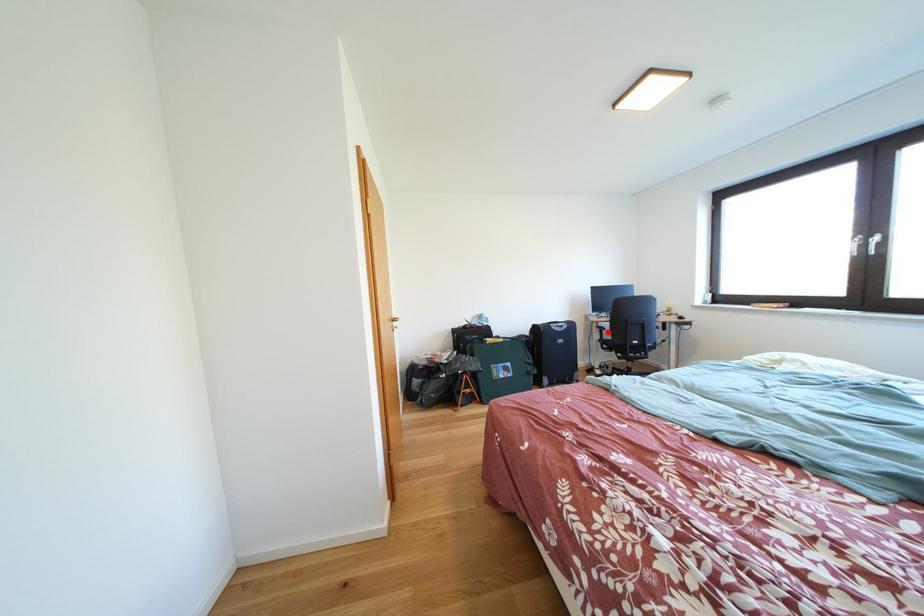
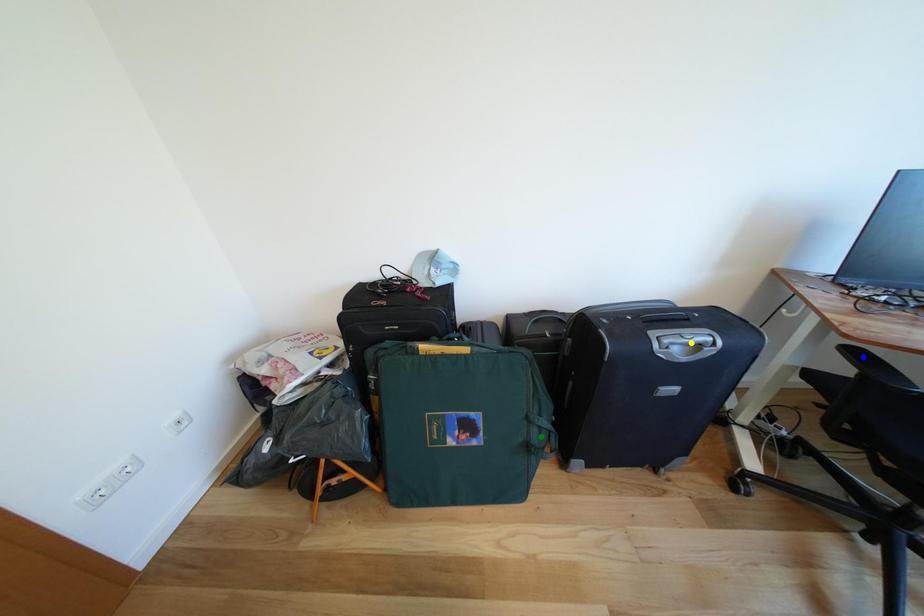
Question: I am providing you with two images of the same scene from different viewpoints. A red point is marked on the first image. You are given multiple points on the second image. Which mark in image 2 goes with the point in image 1?

Choices:
 (A) blue point
 (B) yellow point
 (C) green point

Answer: (A)